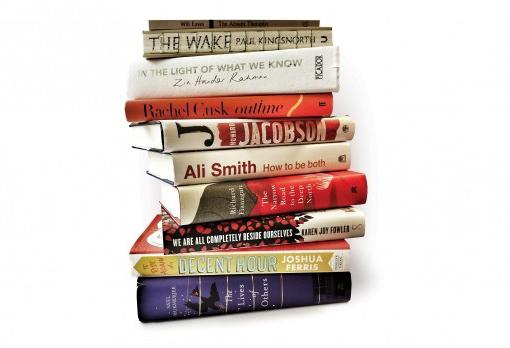
This screenshot has height=348, width=510. Identify the location of books. (180, 301), (197, 263), (207, 228), (207, 200), (209, 165), (205, 132), (206, 108), (206, 73), (194, 41), (173, 22).